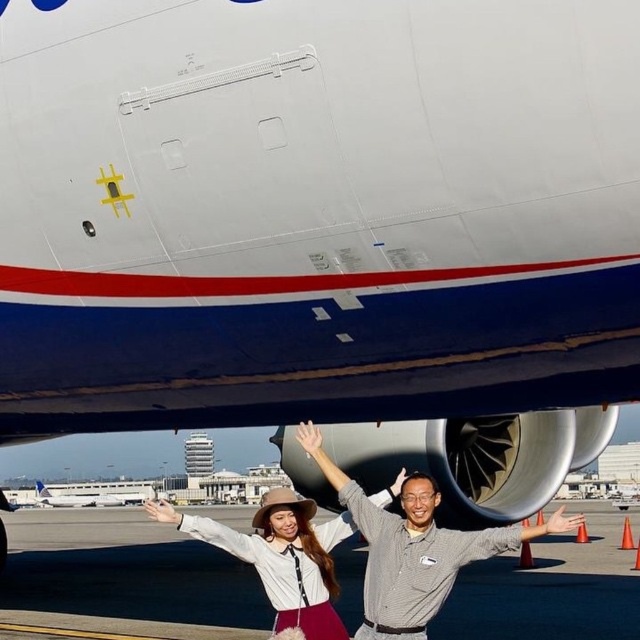
You are standing on the airport tarmac and see the white matte airplane at center and the white matte arm at center. Which object is positioned more to the right side of the image?

The white matte arm at center is positioned more to the right side of the image because the white matte airplane at center is to the left of it.

You are a photographer standing on the airport tarmac. You want to take a photo of the white matte airplane at center and the white matte arm at center. Based on their positions, which object will appear closer to the camera in the photo?

The white matte airplane at center will appear closer to the camera in the photo because the white matte arm at center is positioned behind it, making the airplane more prominent in the foreground.

You are standing on the airport tarmac and see the white matte airplane at center and the matte gray shirt at center. Which object is closer to you?

The white matte airplane at center is closer to you than the matte gray shirt at center.